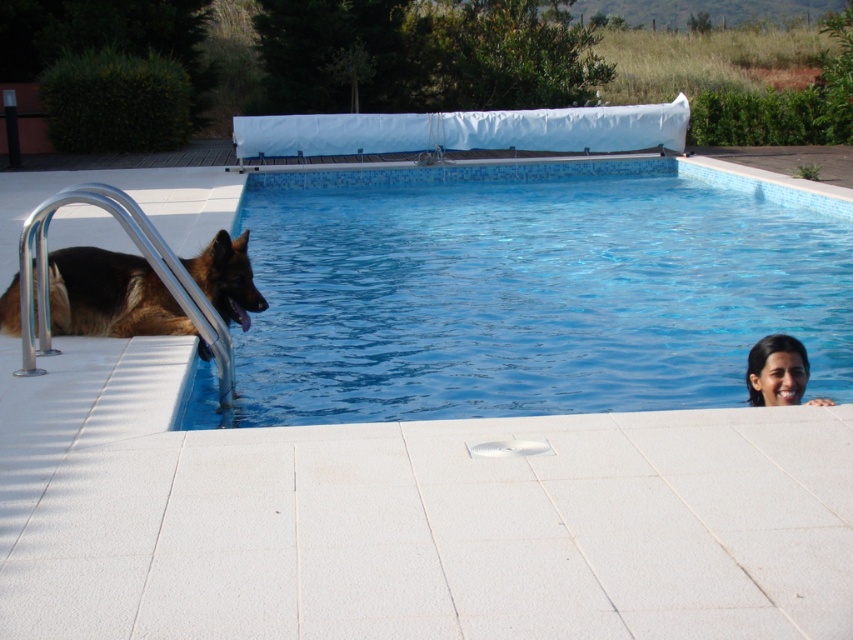
Question: Is brown fur dog at left wider than smooth skin face at upper right?

Choices:
 (A) yes
 (B) no

Answer: (A)

Question: Estimate the real-world distances between objects in this image. Which object is farther from the blue tile pool at center?

Choices:
 (A) brown fur dog at left
 (B) smooth skin face at upper right

Answer: (B)

Question: Among these objects, which one is nearest to the camera?

Choices:
 (A) smooth skin face at upper right
 (B) brown fur dog at left
 (C) blue tile pool at center

Answer: (A)

Question: Can you confirm if blue tile pool at center is wider than smooth skin face at upper right?

Choices:
 (A) no
 (B) yes

Answer: (B)

Question: Which point appears farthest from the camera in this image?

Choices:
 (A) (825, 397)
 (B) (814, 301)

Answer: (B)

Question: Is blue tile pool at center positioned at the back of brown fur dog at left?

Choices:
 (A) no
 (B) yes

Answer: (A)